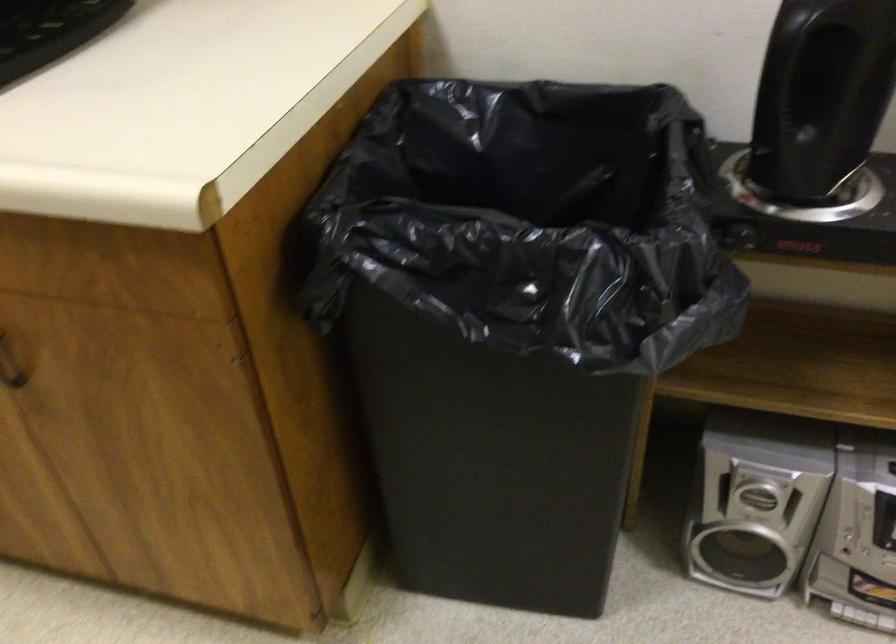
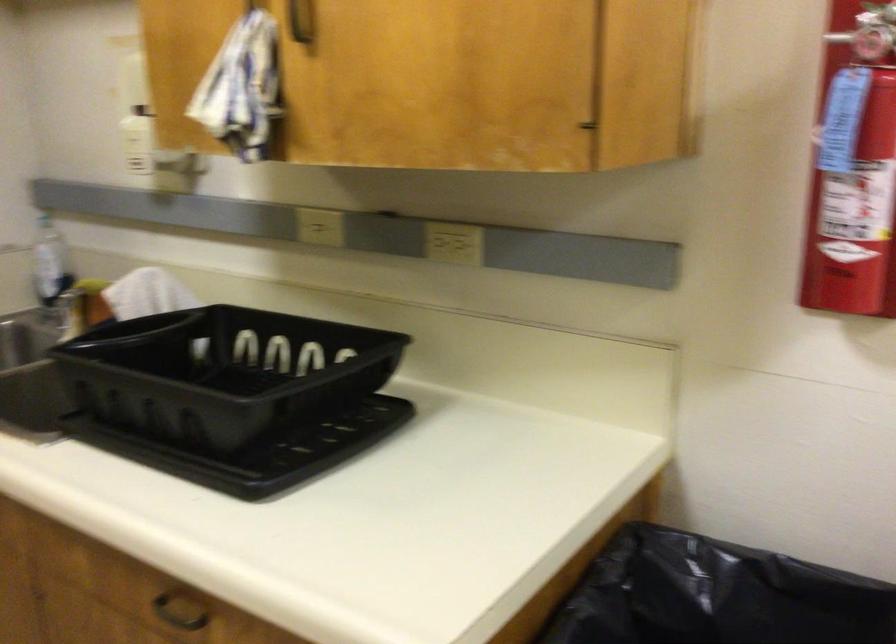
Question: The images are taken continuously from a first-person perspective. In which direction are you moving?

Choices:
 (A) Left
 (B) Right
 (C) Forward
 (D) Backward

Answer: (D)